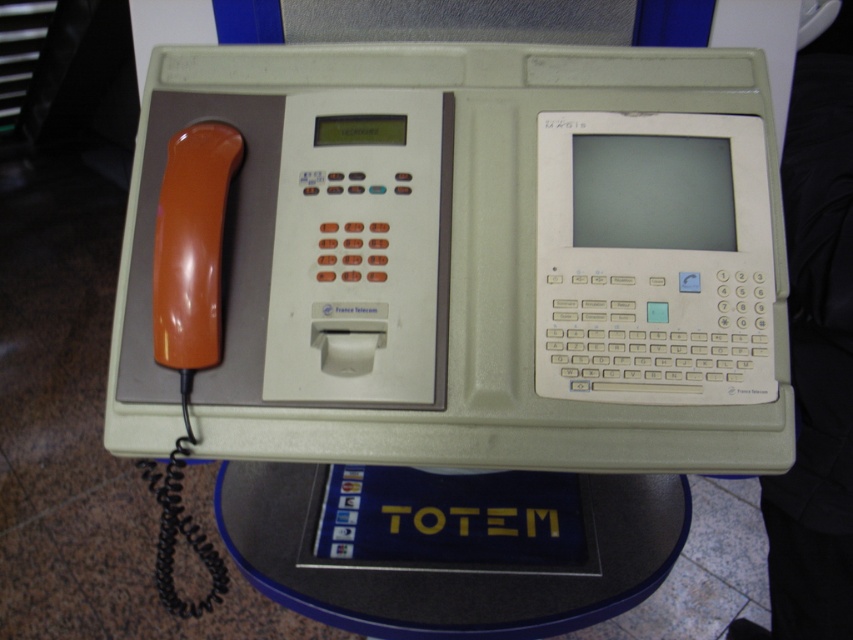
You are a delivery person trying to place a small package on the nearest available surface. You see the matte gray phone box at center and the blue plastic round table at center. Which surface should you choose?

The blue plastic round table at center is the correct surface to place the package because the matte gray phone box at center is positioned on the right side of it, meaning the table is closer to you and more accessible.

You are a person sitting at the blue plastic round table at center. You want to make a phone call using the matte gray phone box at center. Can you reach it without moving from your seat?

The matte gray phone box at center is located above the blue plastic round table at center, so you can reach it without needing to move from your seat.